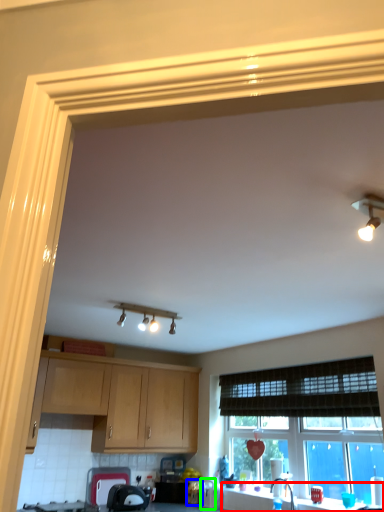
Question: Which is nearer to the counter top (highlighted by a red box)? appliance (highlighted by a blue box) or appliance (highlighted by a green box).

Choices:
 (A) appliance
 (B) appliance

Answer: (B)